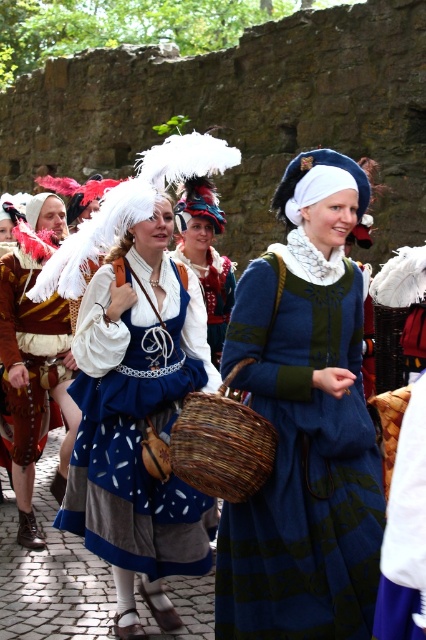
Based on the scene description, what object corresponds to the coordinates point (34, 356)?

The object at coordinates point (34, 356) is the matte white dress at center.